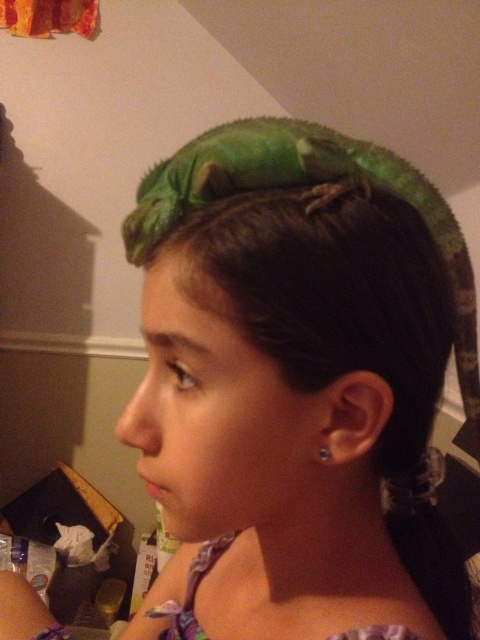
Question: Which point appears closest to the camera in this image?

Choices:
 (A) (420, 182)
 (B) (317, 452)

Answer: (B)

Question: Is green scaly lizard at upper center below clear plastic earring at ear?

Choices:
 (A) no
 (B) yes

Answer: (A)

Question: Which point is farther to the camera?

Choices:
 (A) clear plastic earring at ear
 (B) green scaly lizard at upper center

Answer: (A)

Question: Can you confirm if green scaly lizard at upper center is positioned above clear plastic earring at ear?

Choices:
 (A) no
 (B) yes

Answer: (B)

Question: Which point is closer to the camera taking this photo?

Choices:
 (A) (322, 458)
 (B) (244, 129)

Answer: (A)

Question: Observing the image, what is the correct spatial positioning of green scaly lizard at upper center in reference to clear plastic earring at ear?

Choices:
 (A) left
 (B) right

Answer: (B)